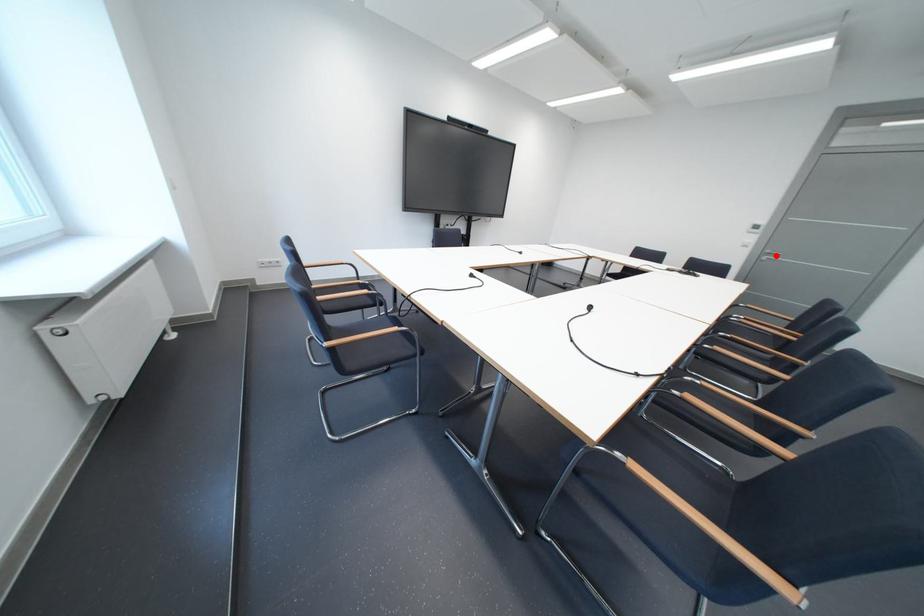
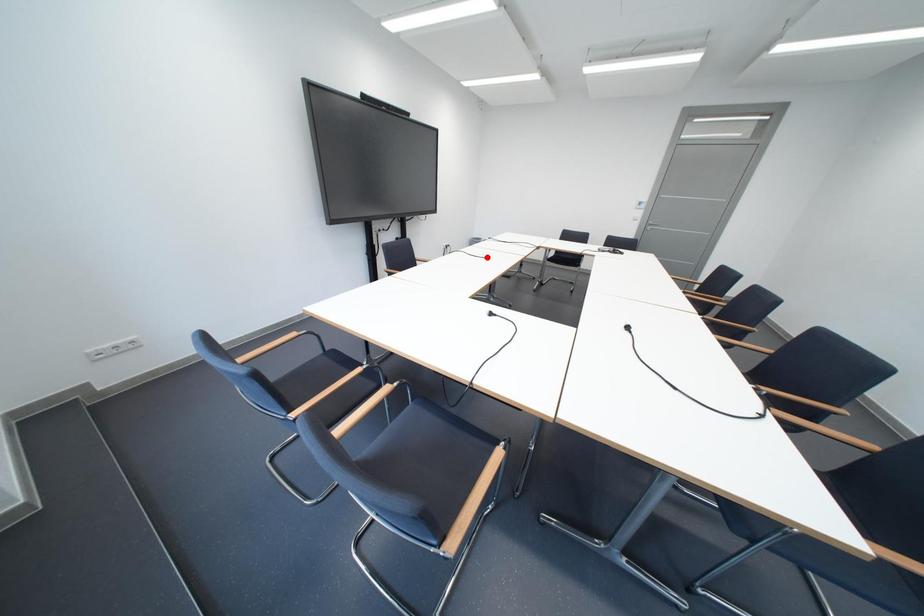
I am providing you with two images of the same scene from different viewpoints. A red point is marked on the first image and another point is marked on the second image. Is the red point in image1 aligned with the point shown in image2?

No